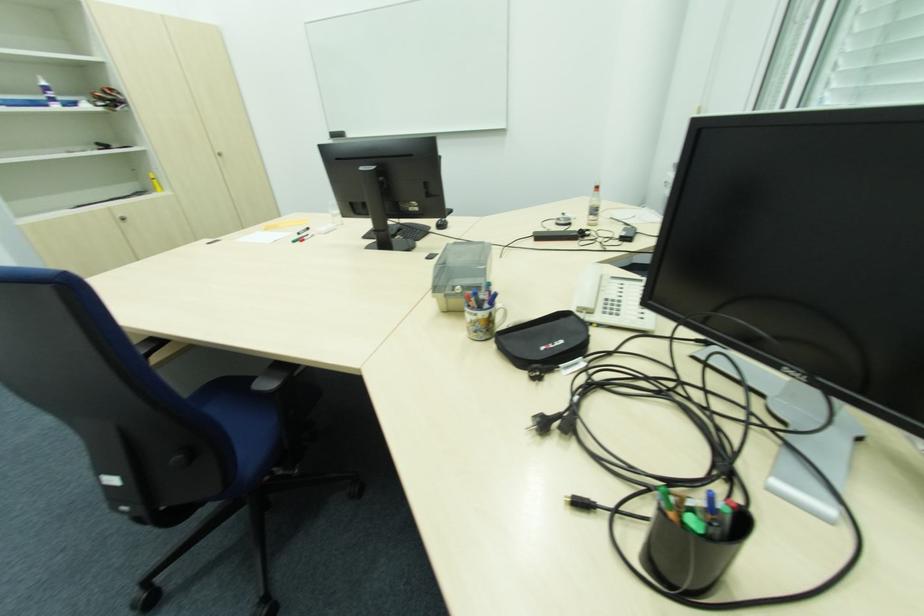
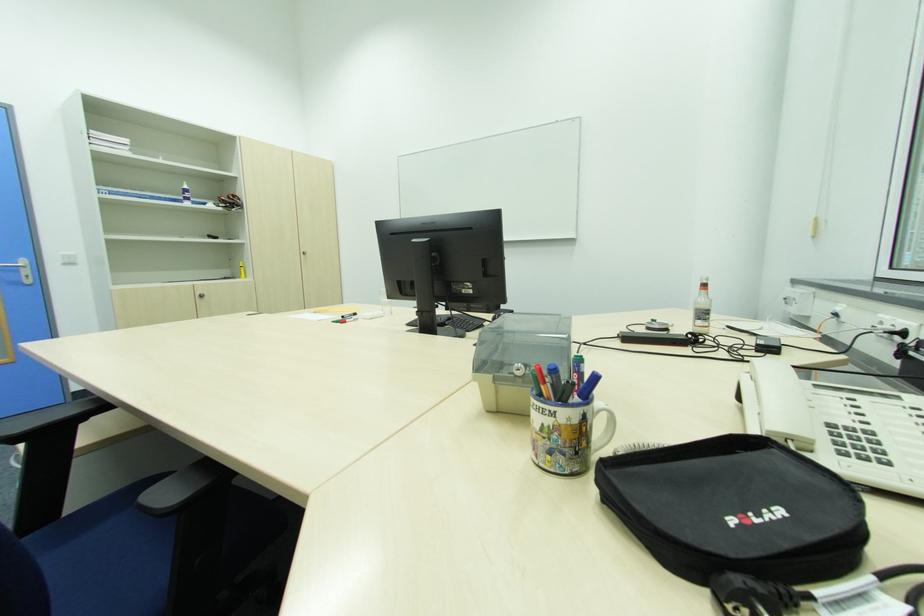
Locate, in the second image, the point that corresponds to [476,304] in the first image.

(550, 391)